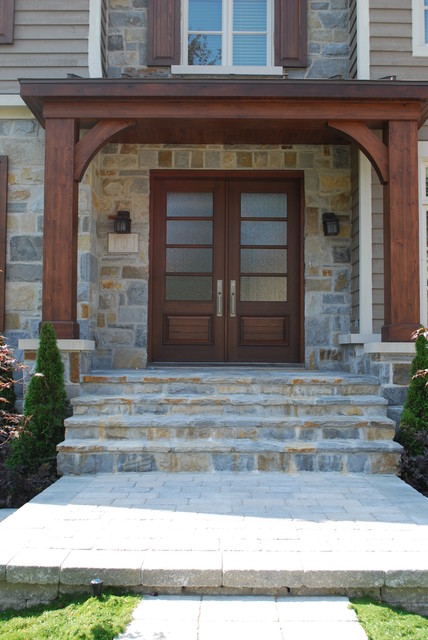
You are a GUI agent. You are given a task and a screenshot of the screen. Output one action in this format:
    pyautogui.click(x=<x>, y=<y>)
    Task: Click on the window frame
    The height and width of the screenshot is (640, 428).
    Given the screenshot: What is the action you would take?
    pyautogui.click(x=227, y=36)